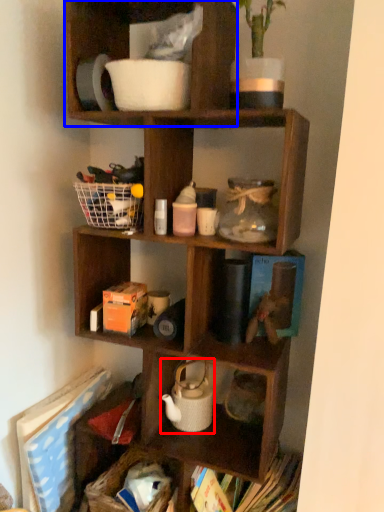
Question: Which point is further to the camera, tea pot (highlighted by a red box) or shelf (highlighted by a blue box)?

Choices:
 (A) tea pot
 (B) shelf

Answer: (A)